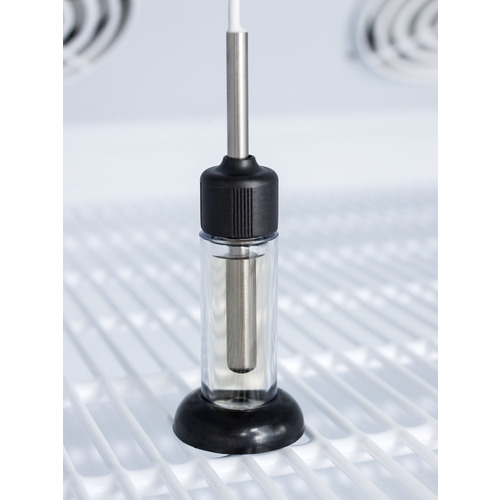
The image size is (500, 500). In order to click on rack in this screenshot , I will do `click(115, 325)`.